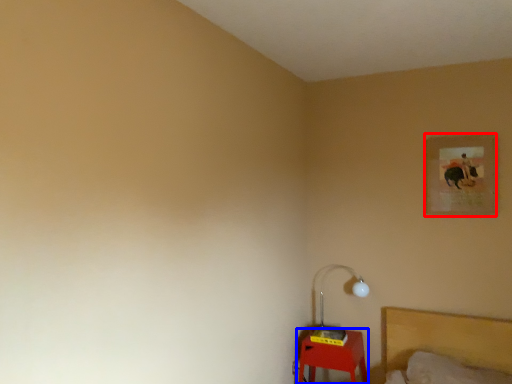
Question: Which point is closer to the camera, picture frame (highlighted by a red box) or furniture (highlighted by a blue box)?

Choices:
 (A) picture frame
 (B) furniture

Answer: (A)